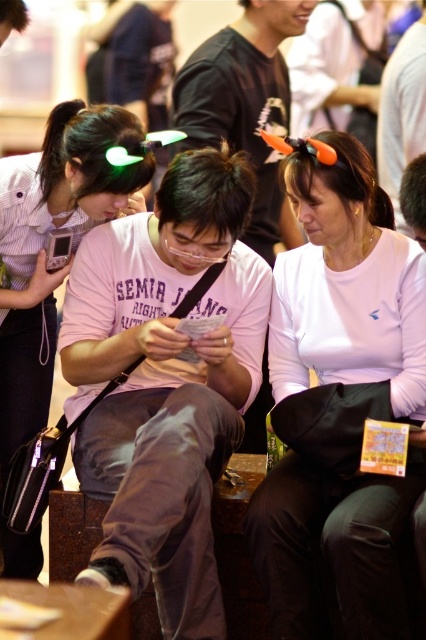
Does white matte hairband at upper center have a smaller size compared to matte pink shirt at center?

Yes.

The image size is (426, 640). Identify the location of white matte hairband at upper center. (339, 396).

Does point (313, 193) lie behind point (49, 392)?

That is False.

Where is `white matte hairband at upper center`? This screenshot has height=640, width=426. white matte hairband at upper center is located at coordinates (339, 396).